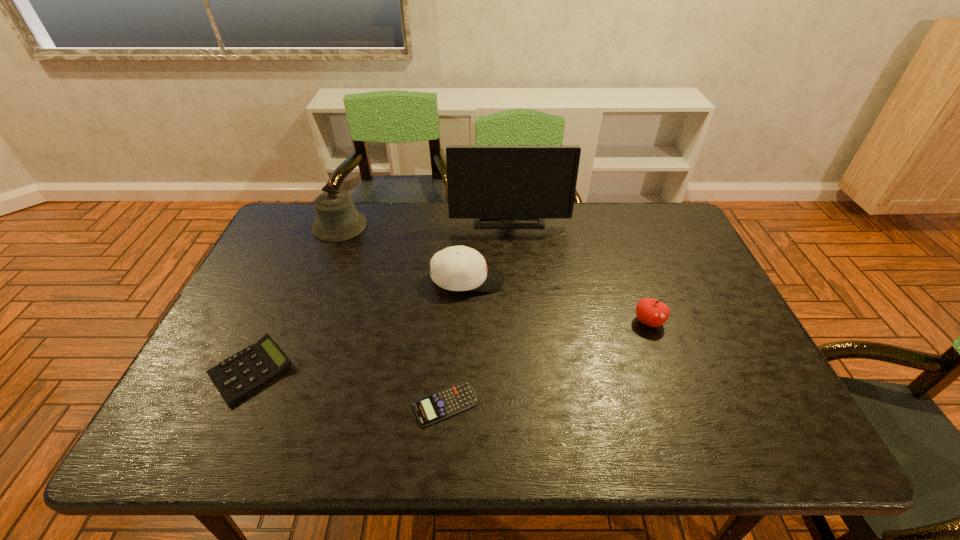
You are a GUI agent. You are given a task and a screenshot of the screen. Output one action in this format:
    pyautogui.click(x=<x>, y=<y>)
    Task: Click on the vacant space that satisfies the following two spatial constraints: 1. on the screen side of the tallest object; 2. on the front-facing side of the fourth nearest object
    
    Given the screenshot: What is the action you would take?
    pyautogui.click(x=514, y=280)

I want to click on vacant space that satisfies the following two spatial constraints: 1. on the screen side of the tallest object; 2. on the front-facing side of the third farthest object, so click(514, 280).

Where is `blank area in the image that satisfies the following two spatial constraints: 1. on the back side of the third shortest object; 2. on the front-facing side of the third farthest object`? blank area in the image that satisfies the following two spatial constraints: 1. on the back side of the third shortest object; 2. on the front-facing side of the third farthest object is located at coordinates (634, 280).